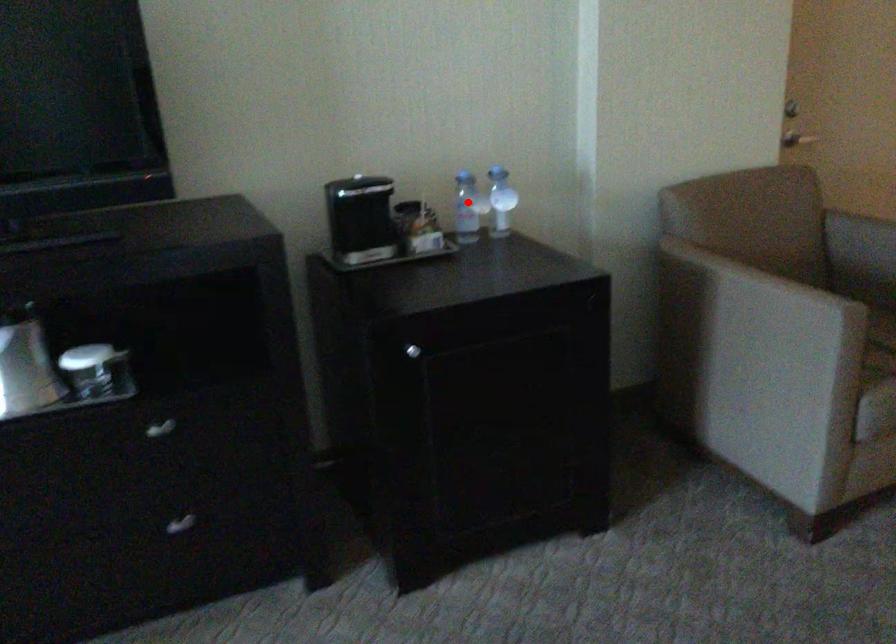
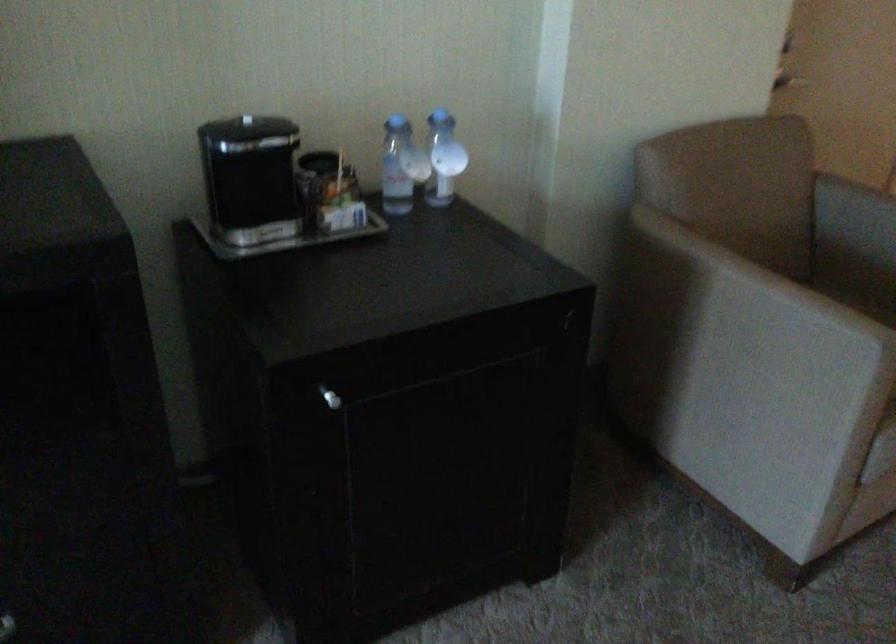
Where in the second image is the point corresponding to the highlighted location from the first image?

(401, 166)